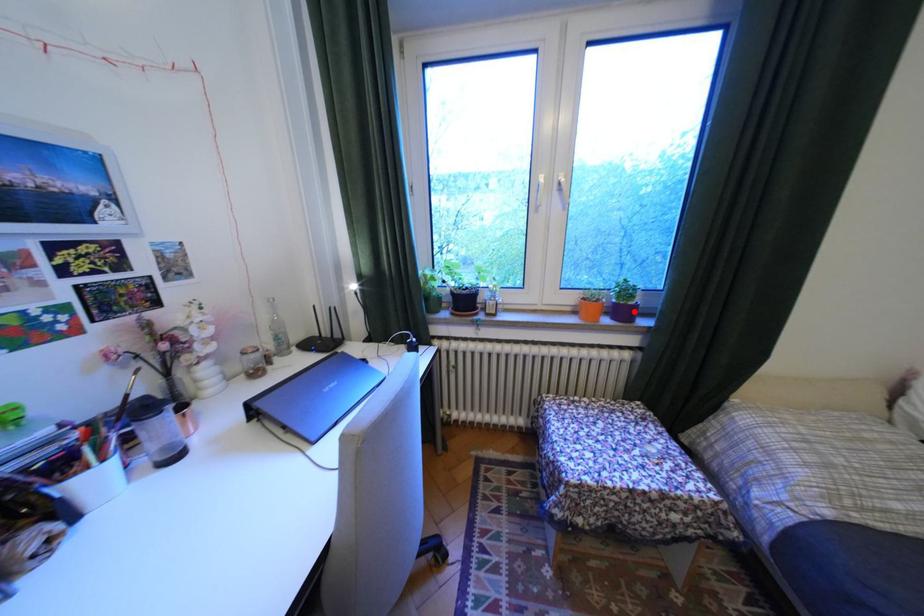
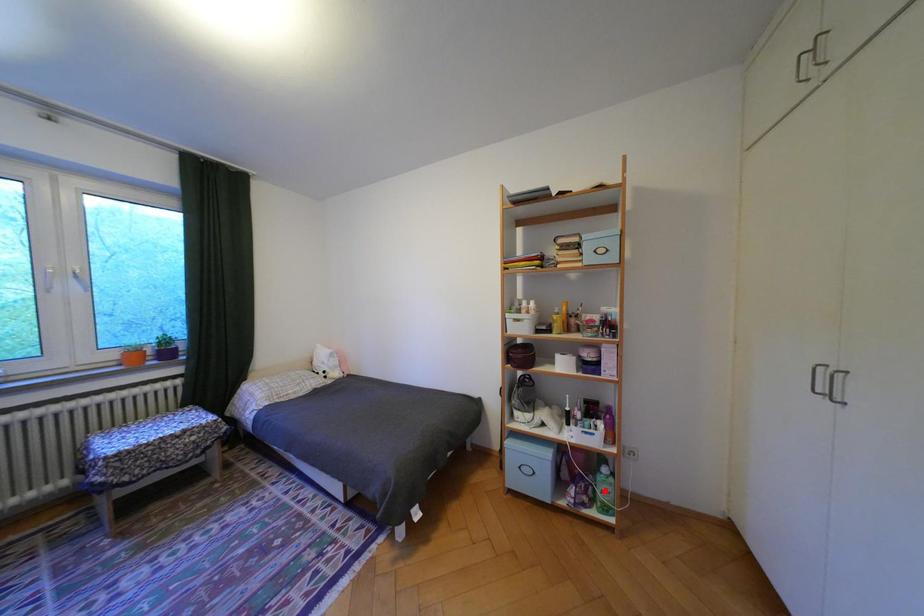
I am providing you with two images of the same scene from different viewpoints. A red point is marked on the first image and another point is marked on the second image. Is the red point in image1 aligned with the point shown in image2?

No